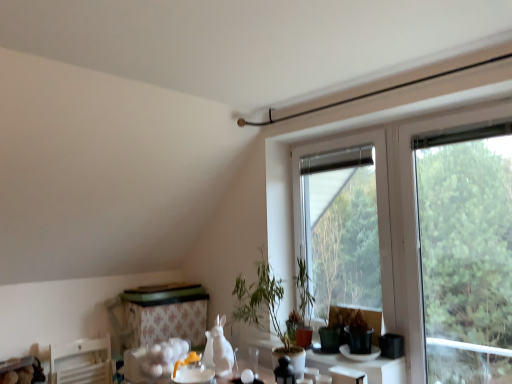
At what (x,y) coordinates should I click in order to perform the action: click on vacant point above green leafy tree at right (from a real-world perspective). Please return your answer as a coordinate pair (x, y). This screenshot has width=512, height=384. Looking at the image, I should click on (455, 110).